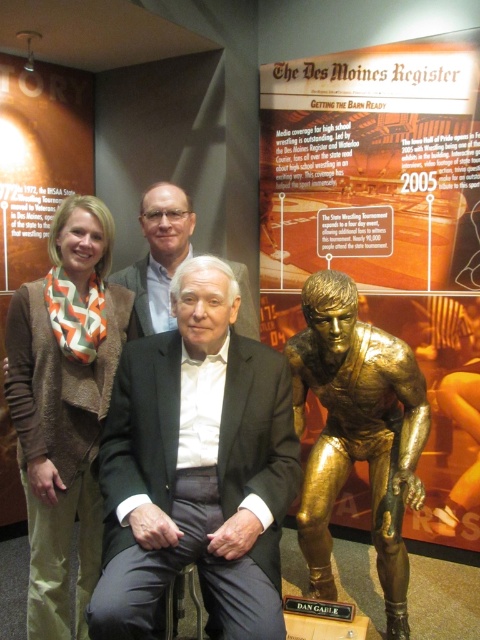
Question: Which object is closer to the camera taking this photo?

Choices:
 (A) matte black suit at center
 (B) gold-bronze figure at center-right

Answer: (A)

Question: Is gold-bronze figure at center-right positioned before white textured suit at center?

Choices:
 (A) yes
 (B) no

Answer: (A)

Question: Can you confirm if gold-bronze figure at center-right is wider than orange chevron scarf at left?

Choices:
 (A) no
 (B) yes

Answer: (B)

Question: Can you confirm if brown chevron scarf at upper left is positioned to the left of gold-bronze figure at center-right?

Choices:
 (A) no
 (B) yes

Answer: (B)

Question: Which object appears closest to the camera in this image?

Choices:
 (A) white textured suit at center
 (B) brown chevron scarf at upper left
 (C) gold/statue at right
 (D) gold-bronze figure at center-right

Answer: (D)

Question: Among these points, which one is farthest from the camera?

Choices:
 (A) (119, 468)
 (B) (393, 536)
 (C) (35, 118)
 (D) (124, 298)

Answer: (C)